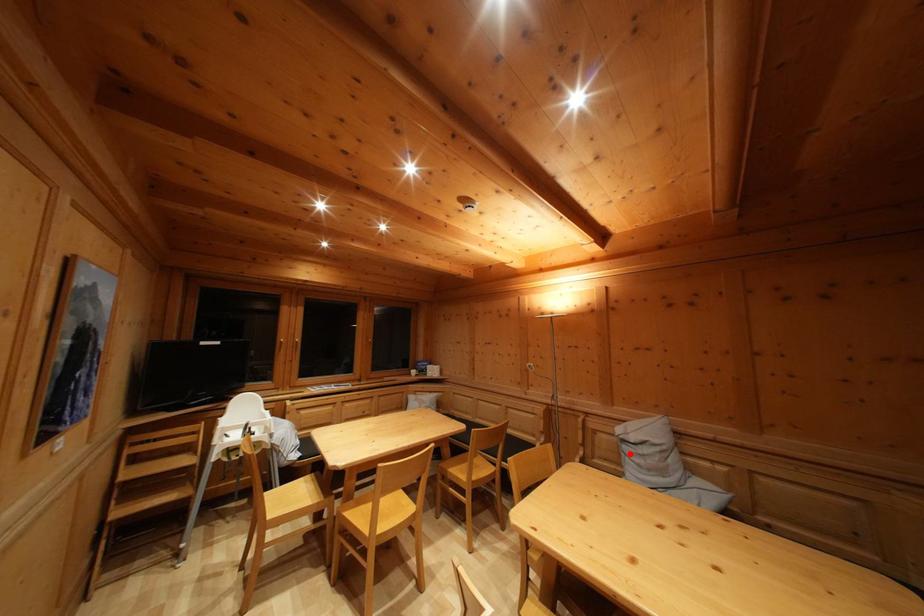
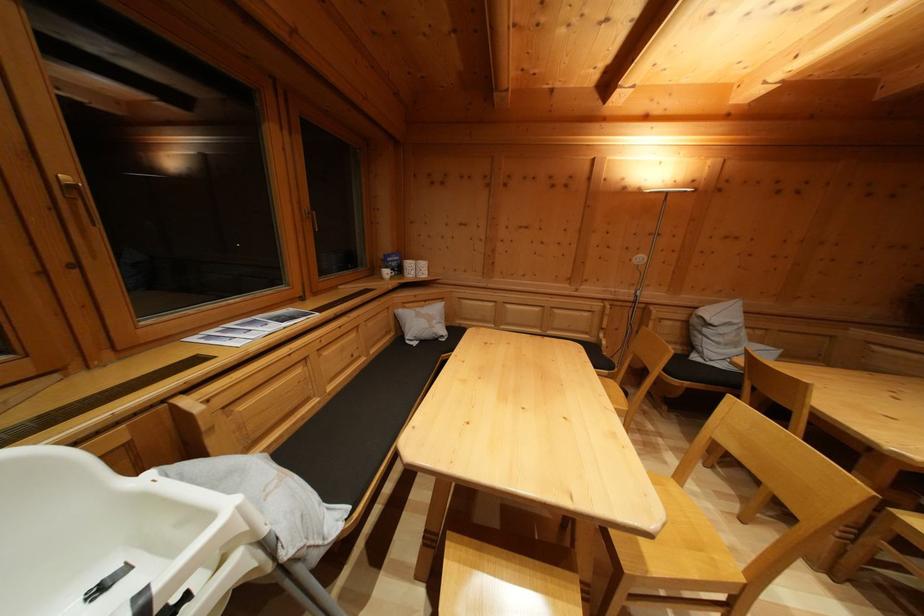
Question: I am providing you with two images of the same scene from different viewpoints. A red point is shown in image1. For the corresponding object point in image2, is it positioned nearer or farther from the camera?

Choices:
 (A) Nearer
 (B) Farther

Answer: (A)